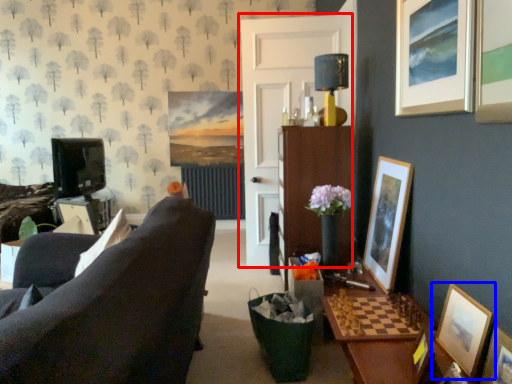
Question: Which object appears farthest to the camera in this image, door (highlighted by a red box) or picture frame (highlighted by a blue box)?

Choices:
 (A) door
 (B) picture frame

Answer: (A)